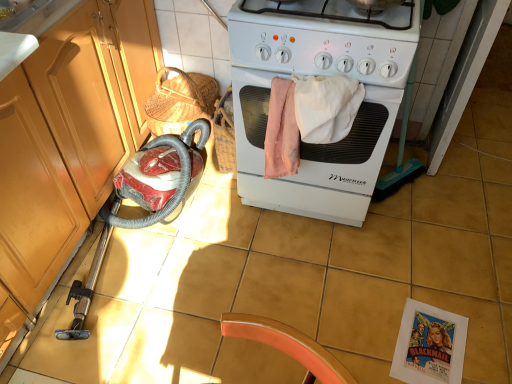
Question: Considering the relative sizes of white glossy gas stove at center and white matte stove at center in the image provided, is white glossy gas stove at center thinner than white matte stove at center?

Choices:
 (A) yes
 (B) no

Answer: (A)

Question: Considering the relative sizes of white glossy gas stove at center and white matte stove at center in the image provided, is white glossy gas stove at center shorter than white matte stove at center?

Choices:
 (A) no
 (B) yes

Answer: (B)

Question: Does white glossy gas stove at center have a greater height compared to white matte stove at center?

Choices:
 (A) no
 (B) yes

Answer: (A)

Question: Can white matte stove at center be found inside white glossy gas stove at center?

Choices:
 (A) yes
 (B) no

Answer: (B)

Question: Is white glossy gas stove at center turned away from white matte stove at center?

Choices:
 (A) no
 (B) yes

Answer: (A)

Question: In terms of width, does matte wood cabinet at left look wider or thinner when compared to white glossy gas stove at center?

Choices:
 (A) thin
 (B) wide

Answer: (B)

Question: Considering the positions of point coord(14,228) and point coord(327,44), is point coord(14,228) closer or farther from the camera than point coord(327,44)?

Choices:
 (A) closer
 (B) farther

Answer: (B)

Question: Visually, is matte wood cabinet at left positioned to the left or to the right of white glossy gas stove at center?

Choices:
 (A) right
 (B) left

Answer: (B)

Question: From the image's perspective, is matte wood cabinet at left positioned above or below white glossy gas stove at center?

Choices:
 (A) above
 (B) below

Answer: (B)

Question: Considering the positions of white glossy gas stove at center and matte wood cabinet at left in the image, is white glossy gas stove at center taller or shorter than matte wood cabinet at left?

Choices:
 (A) tall
 (B) short

Answer: (B)

Question: Is white glossy gas stove at center wider or thinner than matte wood cabinet at left?

Choices:
 (A) wide
 (B) thin

Answer: (B)

Question: From the image's perspective, relative to matte wood cabinet at left, is white glossy gas stove at center above or below?

Choices:
 (A) above
 (B) below

Answer: (A)

Question: Based on their positions, is white glossy gas stove at center located to the left or right of matte wood cabinet at left?

Choices:
 (A) left
 (B) right

Answer: (B)

Question: From the image's perspective, is white glossy gas stove at center located above or below white matte stove at center?

Choices:
 (A) below
 (B) above

Answer: (B)

Question: In the image, is white glossy gas stove at center on the left side or the right side of white matte stove at center?

Choices:
 (A) left
 (B) right

Answer: (A)